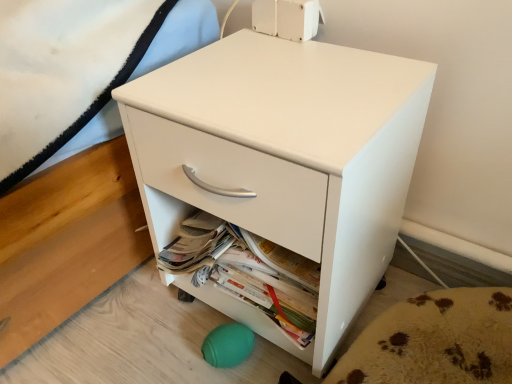
Image resolution: width=512 pixels, height=384 pixels. Describe the element at coordinates (283, 161) in the screenshot. I see `white glossy chest of drawers at center` at that location.

Locate an element on the screen. The image size is (512, 384). white glossy chest of drawers at center is located at coordinates (283, 161).

This screenshot has height=384, width=512. Identify the location of white glossy chest of drawers at center. (283, 161).